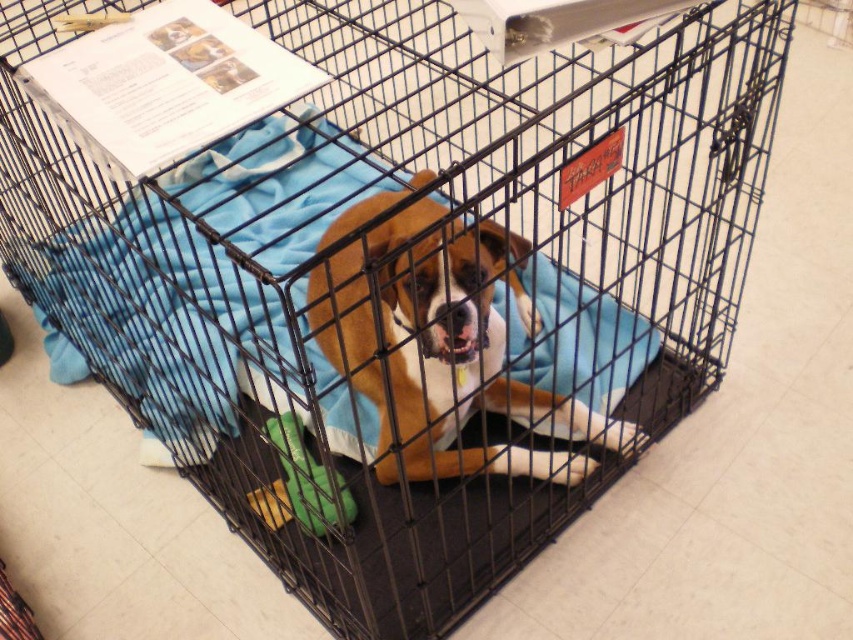
You are a photographer standing at a safe distance from the brown matte dog at center. You want to take a clear photo of the dog without getting too close. Considering the distance, is the dog within your camera lens range if your camera can focus up to 30 inches?

The brown matte dog at center is 31.13 inches away from the camera, which is slightly beyond the camera lens range of 30 inches. Therefore, the dog is just out of focus range.

You are a delivery person who needs to attach a tag to the crate. The tag must be placed at a point closer to you. Which point should you choose between point (479, 384) and point (320, 531)?

Point (479, 384) is closer to the viewer than point (320, 531), so you should choose point (479, 384) to attach the tag.

In the scene shown: You are a veterinarian examining the brown matte dog at center and the green fabric toy at lower center. Which object takes up more space in the crate?

The brown matte dog at center is larger in size than the green fabric toy at lower center, so the brown matte dog at center takes up more space in the crate.